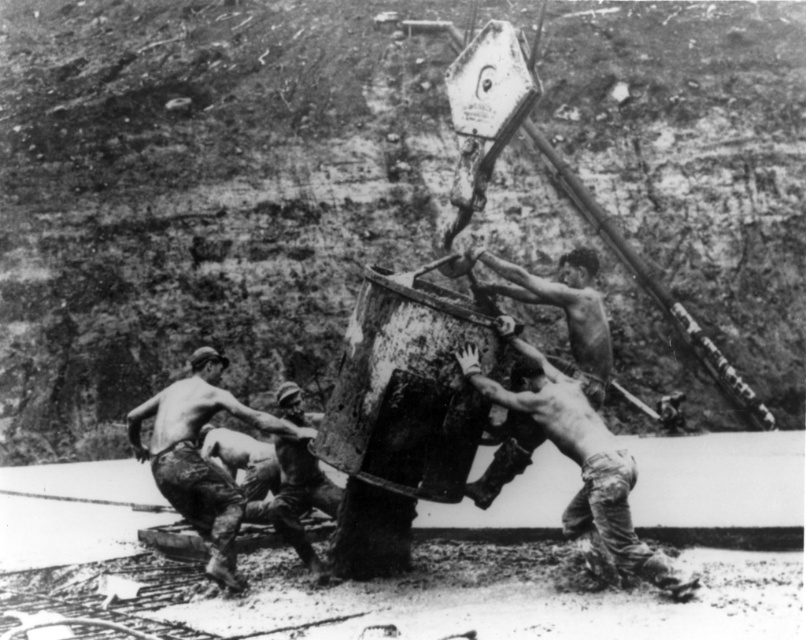
Question: Observing the image, what is the correct spatial positioning of dirty skin man at center in reference to camouflage fabric pants at lower center?

Choices:
 (A) above
 (B) below

Answer: (A)

Question: Does dirty skin man at center appear over dirty skin man at lower left?

Choices:
 (A) yes
 (B) no

Answer: (B)

Question: Which object appears closest to the camera in this image?

Choices:
 (A) camouflage fabric pants at lower center
 (B) dirty skin man at lower left
 (C) dirty skin man at center

Answer: (C)

Question: Which object appears farthest from the camera in this image?

Choices:
 (A) dirty skin man at center
 (B) dirty skin man at lower left
 (C) shiny metal chain at center
 (D) camouflage fabric pants at lower center

Answer: (D)

Question: Which point is farther from the camera taking this photo?

Choices:
 (A) (298, 544)
 (B) (140, 422)
 (C) (530, 280)
 (D) (505, 390)

Answer: (B)

Question: Considering the relative positions of dirty skin man at center and shiny metal chain at center in the image provided, where is dirty skin man at center located with respect to shiny metal chain at center?

Choices:
 (A) below
 (B) above

Answer: (A)